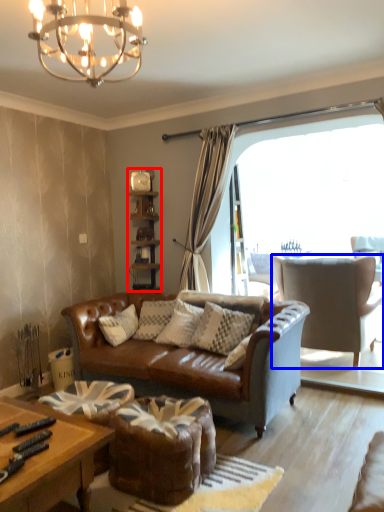
Question: Among these objects, which one is farthest to the camera, shelf (highlighted by a red box) or chair (highlighted by a blue box)?

Choices:
 (A) shelf
 (B) chair

Answer: (A)